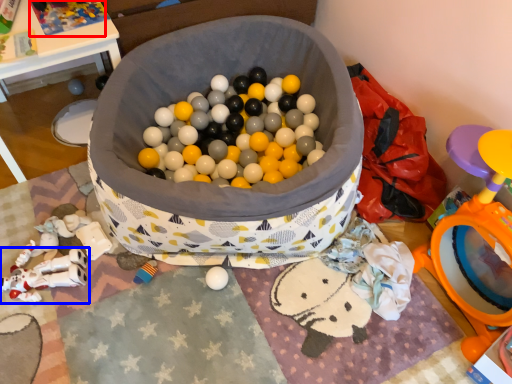
Question: Among these objects, which one is nearest to the camera, toy (highlighted by a red box) or toy (highlighted by a blue box)?

Choices:
 (A) toy
 (B) toy

Answer: (B)